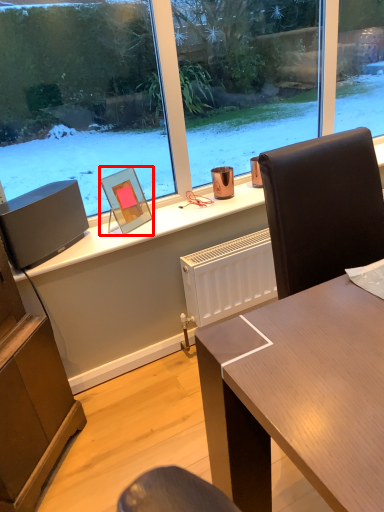
Question: From the image's perspective, considering the relative positions of picture frame (annotated by the red box) and loudspeaker in the image provided, where is picture frame (annotated by the red box) located with respect to the staircase?

Choices:
 (A) above
 (B) below

Answer: (A)